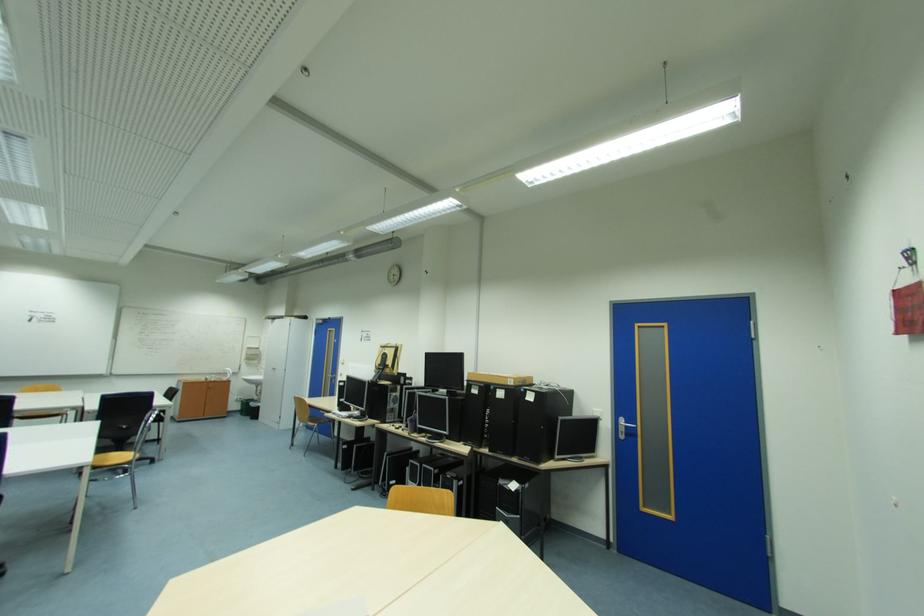
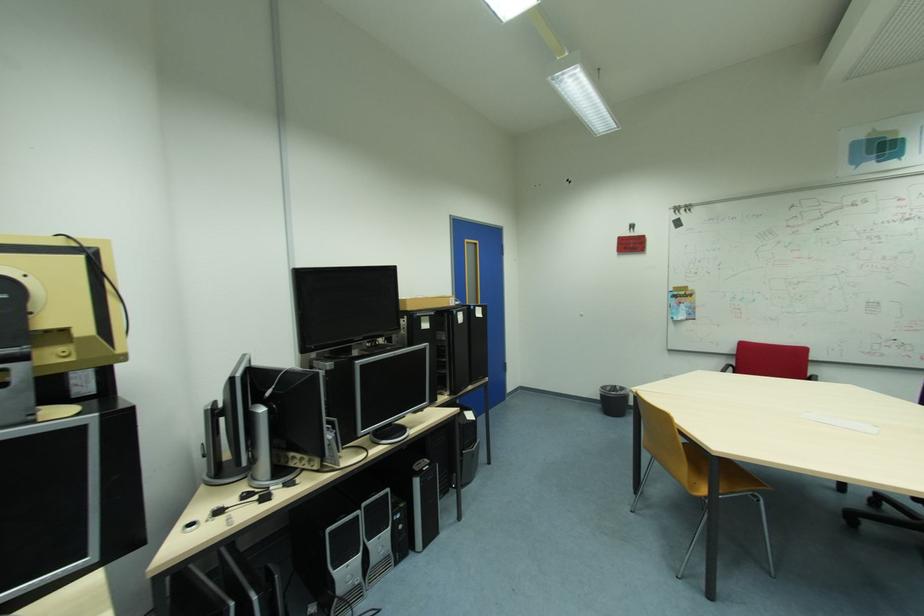
The point at (426,467) is marked in the first image. Where is the corresponding point in the second image?

(365, 517)